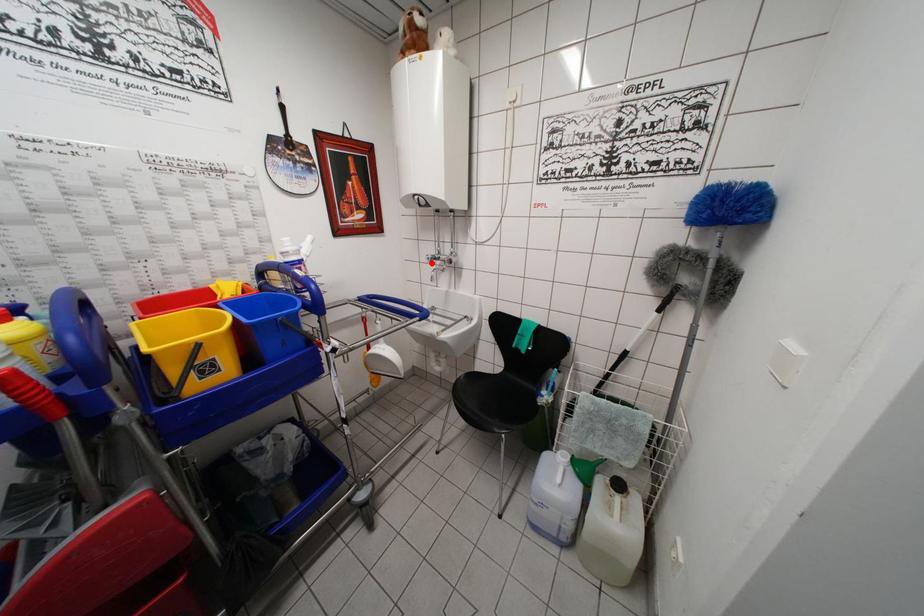
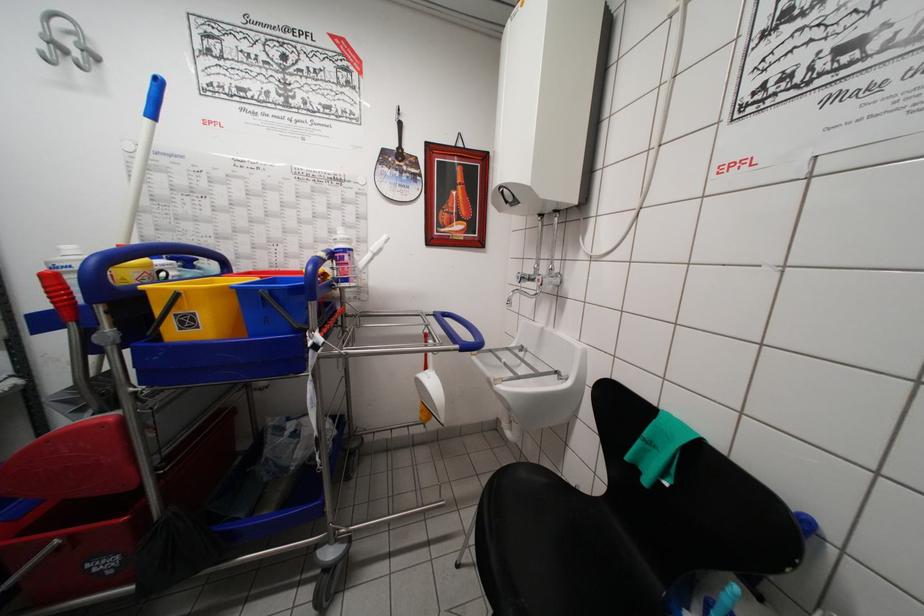
Where in the second image is the point corresponding to the highlighted location from the first image?

(521, 282)